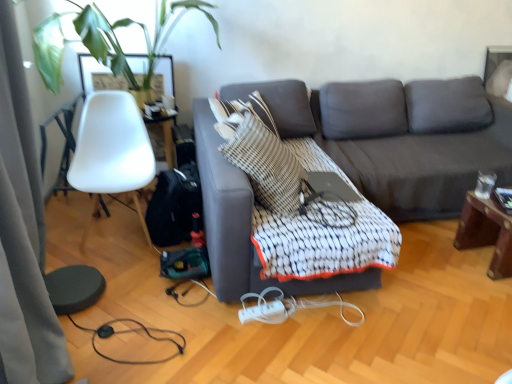
Where is `free region on the left part of white plastic extension cord at lower center`? free region on the left part of white plastic extension cord at lower center is located at coordinates (224, 320).